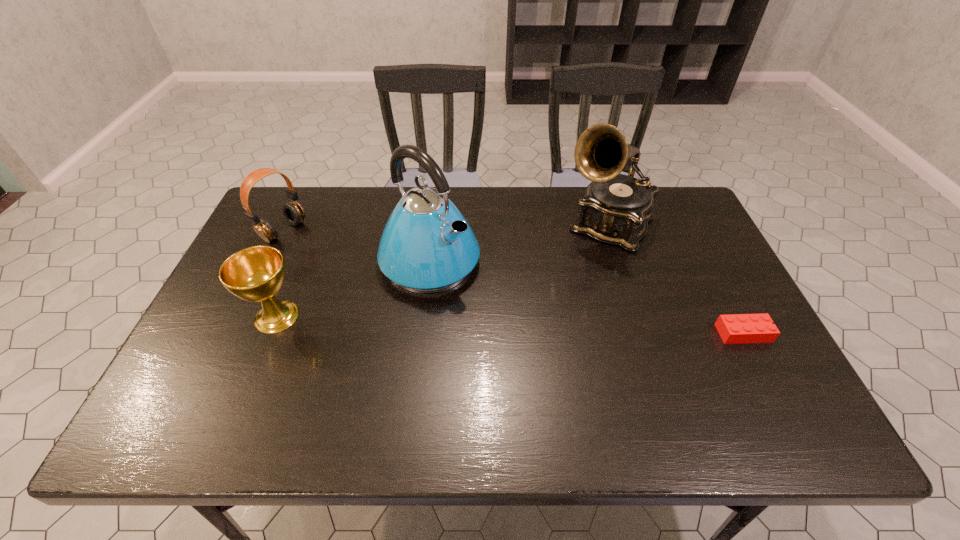
In order to click on free space on the desktop that is between the chalice and the rightmost object and is positioned at the spout of the third object from left to right in this screenshot , I will do `click(520, 325)`.

The image size is (960, 540). Find the location of `free space on the desktop that is between the chalice and the Lego and is positioned on the ear cups of the headset`. free space on the desktop that is between the chalice and the Lego and is positioned on the ear cups of the headset is located at coordinates (437, 322).

Where is `free space on the desktop that is between the chalice and the rightmost object and is positioned on the horn of the phonograph record`? The height and width of the screenshot is (540, 960). free space on the desktop that is between the chalice and the rightmost object and is positioned on the horn of the phonograph record is located at coordinates (548, 326).